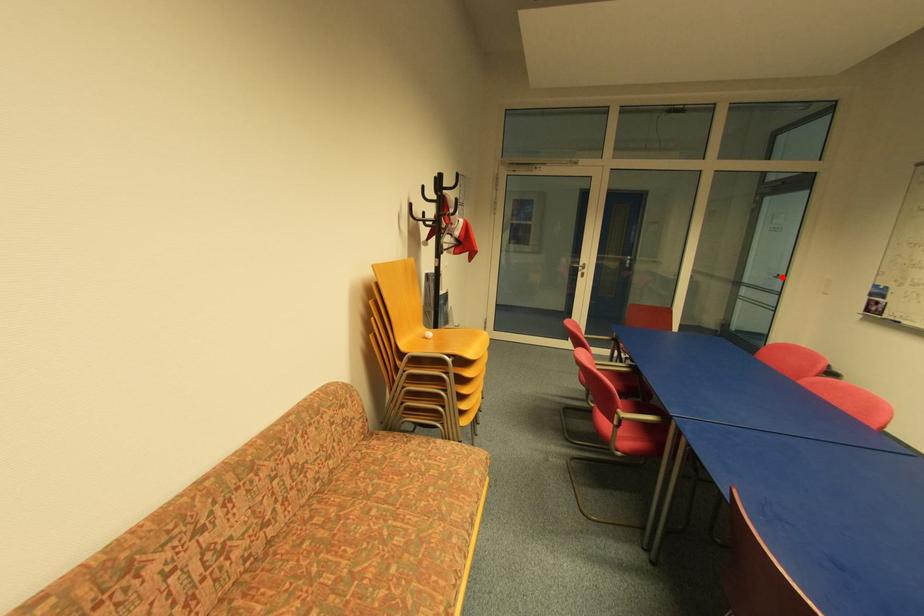
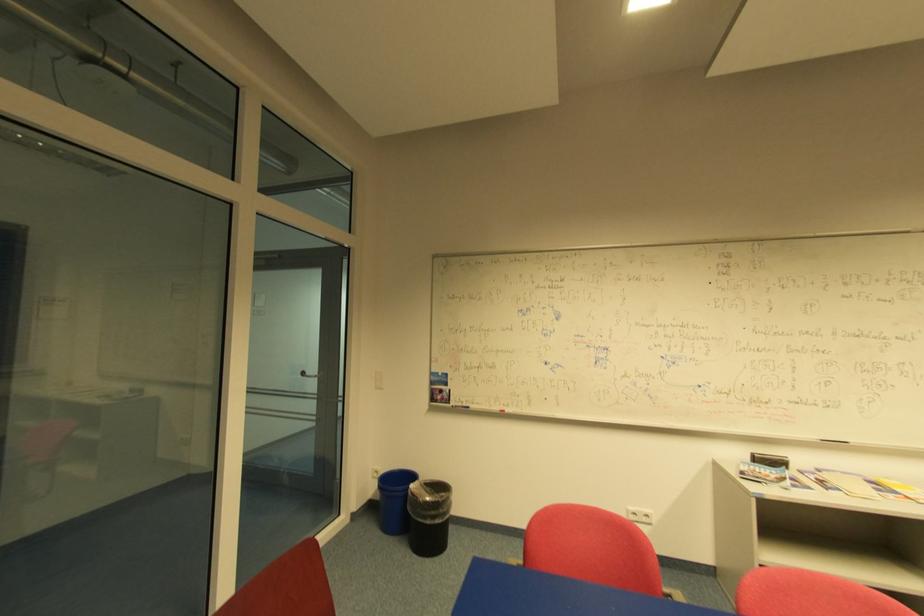
The point at the highlighted location is marked in the first image. Where is the corresponding point in the second image?

(307, 374)